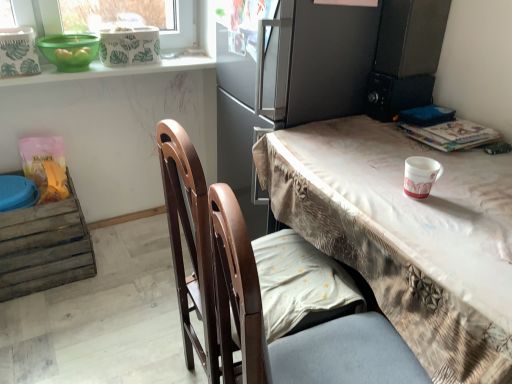
You are a GUI agent. You are given a task and a screenshot of the screen. Output one action in this format:
    pyautogui.click(x=<x>, y=<y>)
    Task: Click on the vacant space in front of hardcover book at upper right
    The width and height of the screenshot is (512, 384).
    Given the screenshot: What is the action you would take?
    pyautogui.click(x=465, y=165)